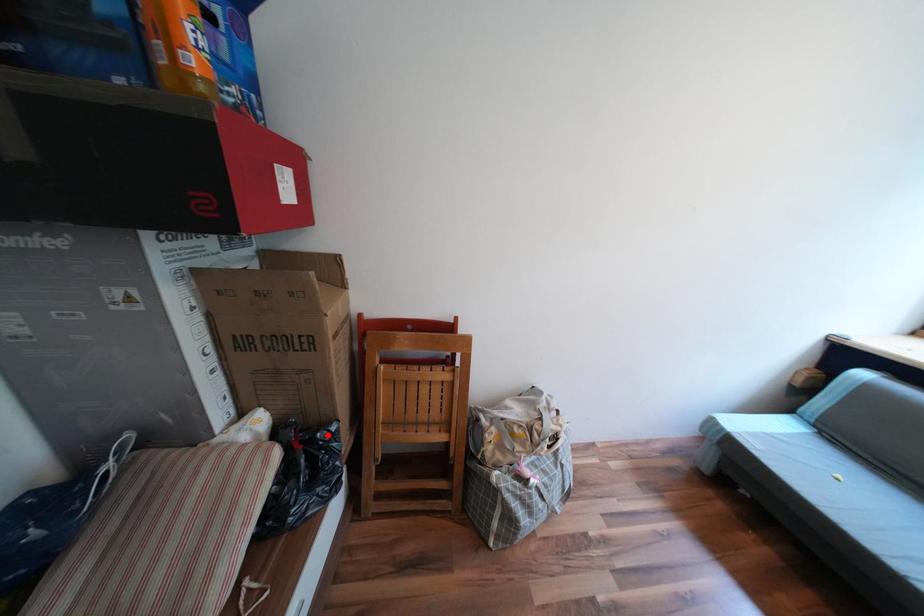
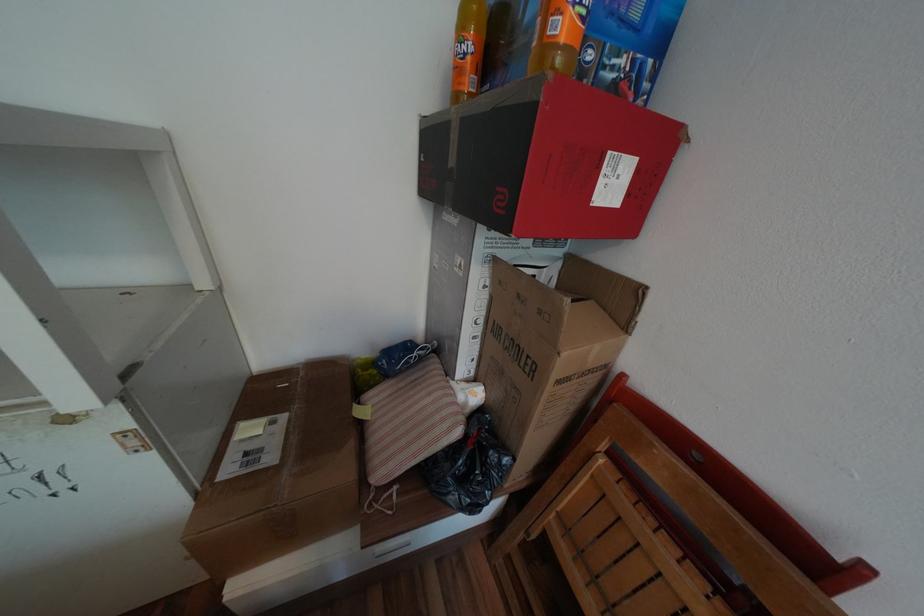
Locate, in the second image, the point that corresponds to the highlighted location in the first image.

(500, 453)